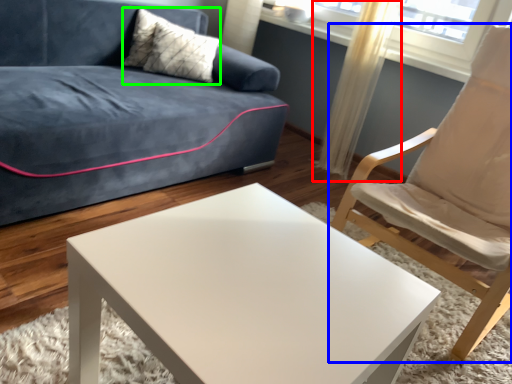
Question: Which is farther away from curtain (highlighted by a red box)? chair (highlighted by a blue box) or pillow (highlighted by a green box)?

Choices:
 (A) chair
 (B) pillow

Answer: (B)